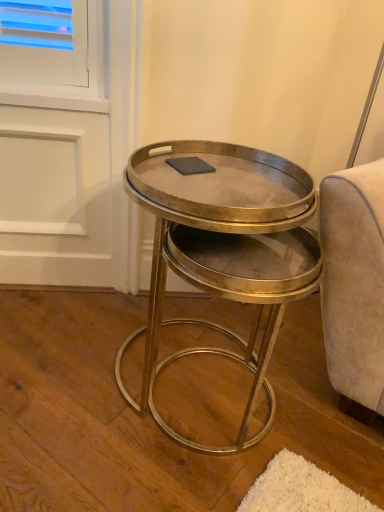
What do you see at coordinates (190, 165) in the screenshot? Image resolution: width=384 pixels, height=512 pixels. I see `matte gray fabric at center` at bounding box center [190, 165].

Where is `matte gray fabric at center`? Image resolution: width=384 pixels, height=512 pixels. matte gray fabric at center is located at coordinates (190, 165).

Locate an element on the screen. The image size is (384, 512). shiny brass coffee table at center is located at coordinates (224, 252).

Image resolution: width=384 pixels, height=512 pixels. What do you see at coordinates (224, 252) in the screenshot?
I see `shiny brass coffee table at center` at bounding box center [224, 252].

At what (x,y) coordinates should I click in order to perform the action: click on matte gray fabric at center. Please return your answer as a coordinate pair (x, y). Looking at the image, I should click on (190, 165).

Consider the image. Would you say shiny brass coffee table at center is to the left or to the right of matte gray fabric at center in the picture?

Based on their positions, shiny brass coffee table at center is located to the right of matte gray fabric at center.

Considering their positions, is shiny brass coffee table at center located in front of or behind matte gray fabric at center?

Visually, shiny brass coffee table at center is located in front of matte gray fabric at center.

Is point (245, 201) less distant than point (166, 161)?

That is True.

From the image's perspective, is shiny brass coffee table at center under matte gray fabric at center?

Yes, from the image's perspective, shiny brass coffee table at center is below matte gray fabric at center.

Looking at this image, from a real-world perspective, is shiny brass coffee table at center beneath matte gray fabric at center?

Yes, from a real-world perspective, shiny brass coffee table at center is below matte gray fabric at center.

Is shiny brass coffee table at center wider than matte gray fabric at center?

Yes, shiny brass coffee table at center is wider than matte gray fabric at center.

Can you confirm if shiny brass coffee table at center is shorter than matte gray fabric at center?

No.

Considering the sizes of shiny brass coffee table at center and matte gray fabric at center in the image, is shiny brass coffee table at center bigger or smaller than matte gray fabric at center?

shiny brass coffee table at center is bigger than matte gray fabric at center.

Is matte gray fabric at center inside shiny brass coffee table at center?

Actually, matte gray fabric at center is outside shiny brass coffee table at center.

Are shiny brass coffee table at center and matte gray fabric at center far apart?

shiny brass coffee table at center is actually quite close to matte gray fabric at center.

Is shiny brass coffee table at center facing towards matte gray fabric at center?

No.

How many degrees apart are the facing directions of shiny brass coffee table at center and matte gray fabric at center?

70.9 degrees separate the facing orientations of shiny brass coffee table at center and matte gray fabric at center.

How distant is shiny brass coffee table at center from matte gray fabric at center?

shiny brass coffee table at center and matte gray fabric at center are 29.77 centimeters apart.

Where is `pad that is above the shiny brass coffee table at center (from the image's perspective)`? The image size is (384, 512). pad that is above the shiny brass coffee table at center (from the image's perspective) is located at coordinates (190, 165).

Considering the relative positions of matte gray fabric at center and shiny brass coffee table at center in the image provided, is matte gray fabric at center to the left of shiny brass coffee table at center from the viewer's perspective?

Correct, you'll find matte gray fabric at center to the left of shiny brass coffee table at center.

Between matte gray fabric at center and shiny brass coffee table at center, which one is positioned in front?

shiny brass coffee table at center.

Based on the photo, which is less distant, (197, 172) or (272, 420)?

The point (197, 172) is more forward.

From the picture: From the image's perspective, between matte gray fabric at center and shiny brass coffee table at center, who is located below?

shiny brass coffee table at center is shown below in the image.

From a real-world perspective, which is physically below, matte gray fabric at center or shiny brass coffee table at center?

shiny brass coffee table at center is physically lower.

In terms of width, does matte gray fabric at center look wider or thinner when compared to shiny brass coffee table at center?

Clearly, matte gray fabric at center has less width compared to shiny brass coffee table at center.

Who is taller, matte gray fabric at center or shiny brass coffee table at center?

shiny brass coffee table at center is taller.

Considering the relative sizes of matte gray fabric at center and shiny brass coffee table at center in the image provided, is matte gray fabric at center bigger than shiny brass coffee table at center?

No.

Is matte gray fabric at center inside the boundaries of shiny brass coffee table at center, or outside?

matte gray fabric at center is not enclosed by shiny brass coffee table at center.

Is matte gray fabric at center not near shiny brass coffee table at center?

That's not correct — matte gray fabric at center is a little close to shiny brass coffee table at center.

Could you tell me if matte gray fabric at center is facing shiny brass coffee table at center?

No, matte gray fabric at center is not oriented towards shiny brass coffee table at center.

Can you tell me how much matte gray fabric at center and shiny brass coffee table at center differ in facing direction?

The angular difference between matte gray fabric at center and shiny brass coffee table at center is 70.9 degrees.

You are a GUI agent. You are given a task and a screenshot of the screen. Output one action in this format:
    pyautogui.click(x=<x>, y=<y>)
    Task: Click on the coffee table lying on the right of matte gray fabric at center
    The width and height of the screenshot is (384, 512).
    Given the screenshot: What is the action you would take?
    pyautogui.click(x=224, y=252)

Identify the location of pad located on the left of shiny brass coffee table at center. (190, 165).

Identify the location of coffee table below the matte gray fabric at center (from the image's perspective). This screenshot has width=384, height=512. (224, 252).